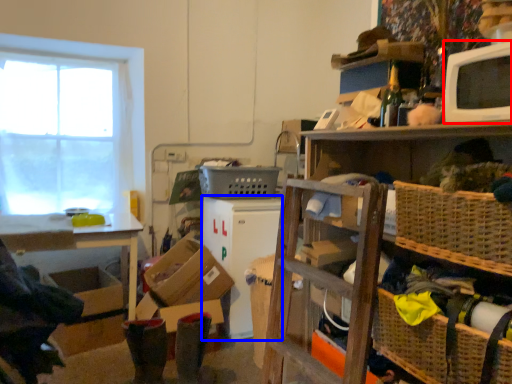
Question: Among these objects, which one is farthest to the camera, appliance (highlighted by a red box) or appliance (highlighted by a blue box)?

Choices:
 (A) appliance
 (B) appliance

Answer: (B)